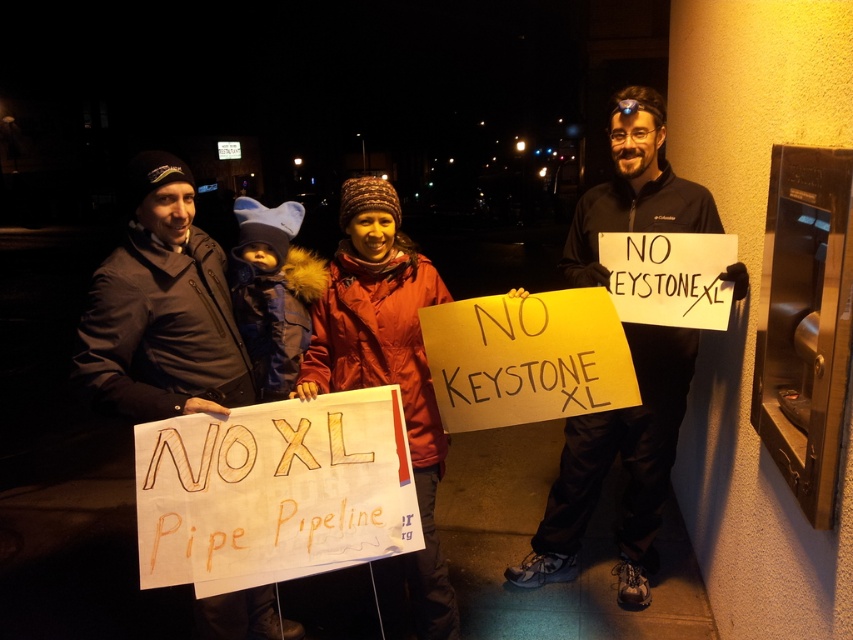
Question: Does matte black jacket at right have a larger size compared to dark gray jacket at center?

Choices:
 (A) no
 (B) yes

Answer: (B)

Question: In this image, where is matte black jacket at right located relative to dark gray jacket at center?

Choices:
 (A) below
 (B) above

Answer: (A)

Question: Among these objects, which one is farthest from the camera?

Choices:
 (A) matte black jacket at right
 (B) dark gray jacket at center

Answer: (A)

Question: Can you confirm if matte black jacket at right is positioned to the right of dark gray jacket at center?

Choices:
 (A) yes
 (B) no

Answer: (A)